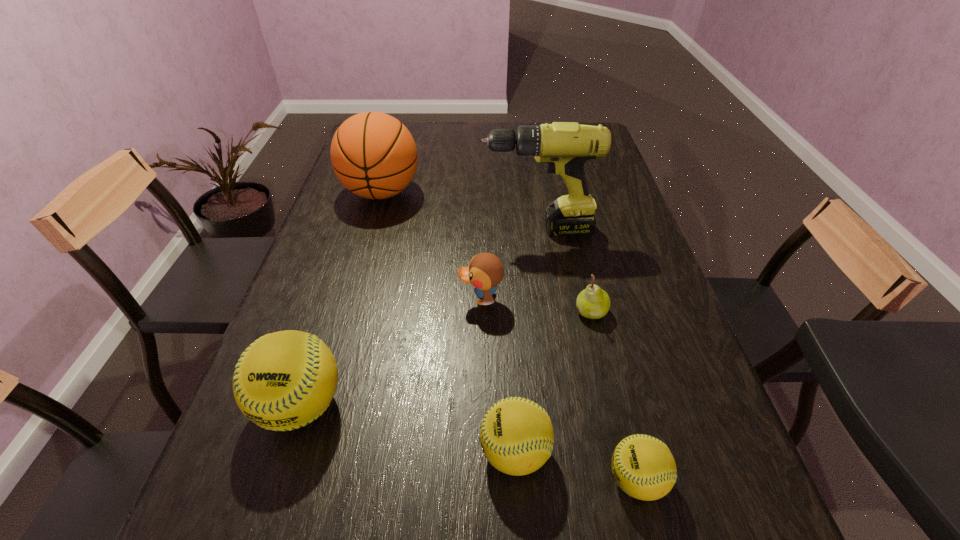
The image size is (960, 540). Find the location of `the third tallest object`. the third tallest object is located at coordinates 284,380.

Identify the location of the tallest softball. This screenshot has width=960, height=540. (284, 380).

Where is `the second softball from left to right`? the second softball from left to right is located at coordinates (516, 435).

This screenshot has width=960, height=540. I want to click on the shortest softball, so click(x=644, y=468).

Locate an element on the screen. the shortest object is located at coordinates (644, 468).

Locate an element on the screen. pear is located at coordinates (593, 302).

Find the location of a particular element. The height and width of the screenshot is (540, 960). the farthest object is located at coordinates (373, 155).

You are a GUI agent. You are given a task and a screenshot of the screen. Output one action in this format:
    pyautogui.click(x=<x>, y=<y>)
    Task: Click on the basketball
    Image resolution: width=960 pixels, height=540 pixels.
    Given the screenshot: What is the action you would take?
    pyautogui.click(x=373, y=155)

You are a GUI agent. You are given a task and a screenshot of the screen. Output one action in this format:
    pyautogui.click(x=<x>, y=<y>)
    Task: Click on the drill
    
    Given the screenshot: What is the action you would take?
    pyautogui.click(x=565, y=146)

Locate an element on the screen. The height and width of the screenshot is (540, 960). the second farthest object is located at coordinates (565, 146).